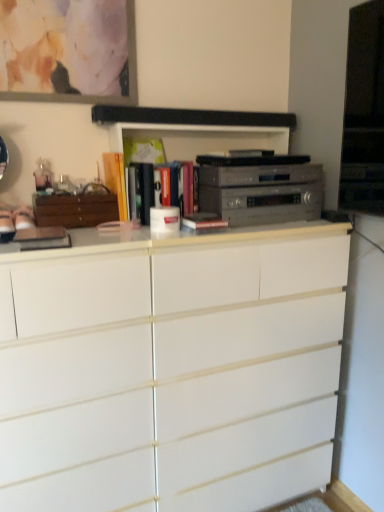
The image size is (384, 512). Identify the location of space that is in front of matte orange book at center, the fourth book positioned from the right. (101, 234).